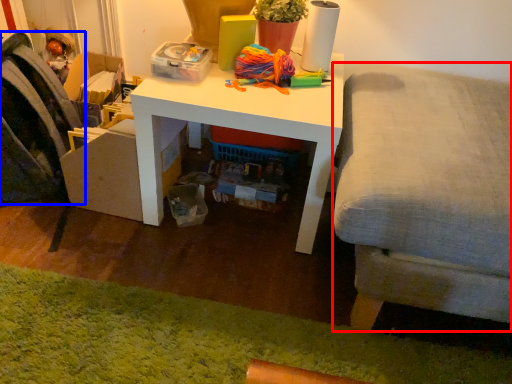
Question: Which object is closer to the camera taking this photo, studio couch (highlighted by a red box) or swivel chair (highlighted by a blue box)?

Choices:
 (A) studio couch
 (B) swivel chair

Answer: (A)